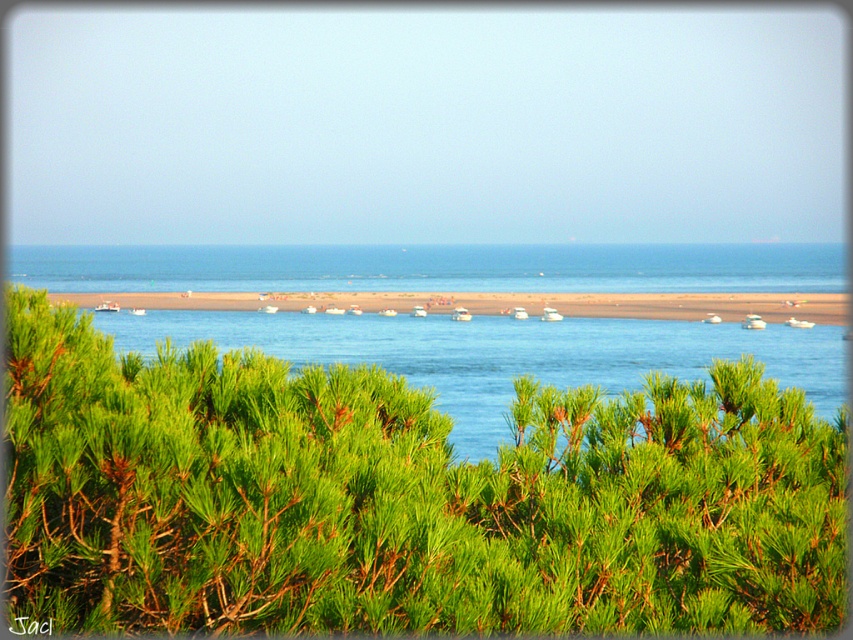
You are planning to place a small garden ornament that requires a space of 1 square meter. Based on the scene, which object between the green leafy bush at center and the brown sand at center would be more suitable for placing the ornament?

The brown sand at center is more suitable because it has a larger area compared to the green leafy bush at center, which is smaller in size.